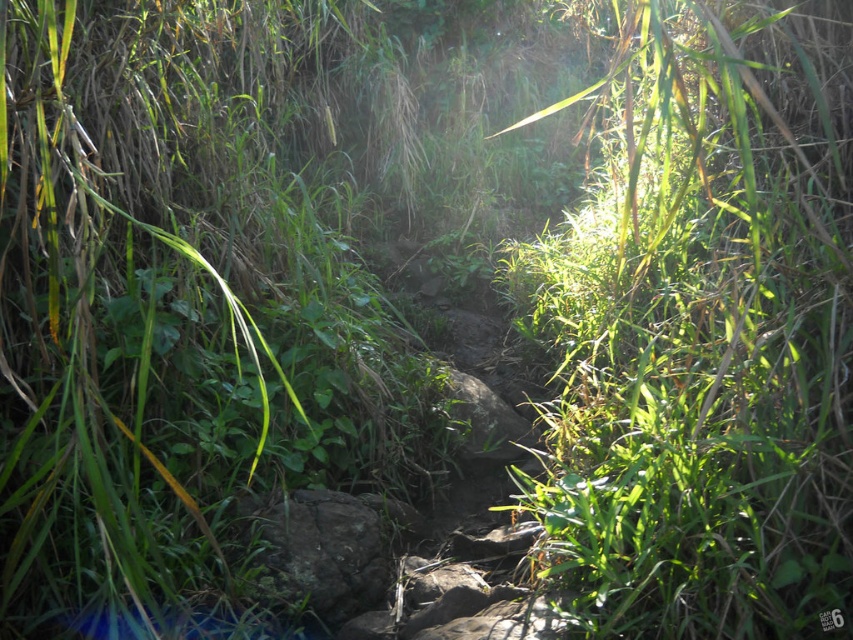
Question: Is green leafy grass at center thinner than gray rough rock at center?

Choices:
 (A) no
 (B) yes

Answer: (A)

Question: Is green leafy grass at center to the right of gray rough rock at center from the viewer's perspective?

Choices:
 (A) no
 (B) yes

Answer: (B)

Question: Does green leafy grass at center lie behind gray rough rock at center?

Choices:
 (A) no
 (B) yes

Answer: (A)

Question: Which point appears closest to the camera in this image?

Choices:
 (A) (821, 493)
 (B) (329, 540)

Answer: (A)

Question: Which point is farther to the camera?

Choices:
 (A) gray rough rock at center
 (B) green leafy grass at center

Answer: (A)